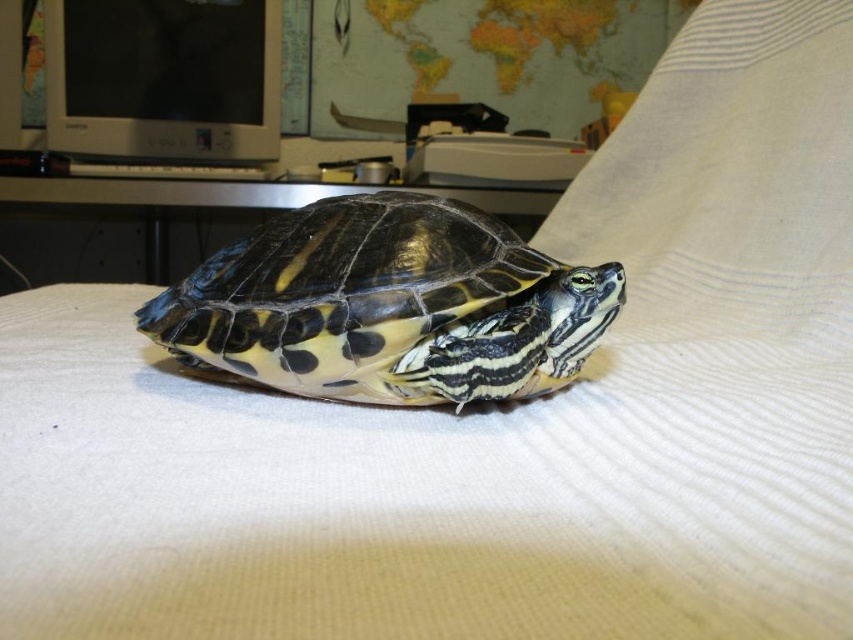
Question: Which is farther from the shiny black tortoise at center?

Choices:
 (A) metallic silver table at center
 (B) matte silver computer monitor at upper left

Answer: (B)

Question: Which point is closer to the camera taking this photo?

Choices:
 (A) (519, 296)
 (B) (91, 42)
 (C) (30, 177)

Answer: (A)

Question: Which point appears closest to the camera in this image?

Choices:
 (A) (59, 204)
 (B) (257, 253)
 (C) (245, 49)

Answer: (B)

Question: Does shiny black tortoise at center appear on the right side of matte silver computer monitor at upper left?

Choices:
 (A) no
 (B) yes

Answer: (B)

Question: Is matte silver computer monitor at upper left wider than metallic silver table at center?

Choices:
 (A) no
 (B) yes

Answer: (A)

Question: Can you confirm if shiny black tortoise at center is bigger than metallic silver table at center?

Choices:
 (A) no
 (B) yes

Answer: (A)